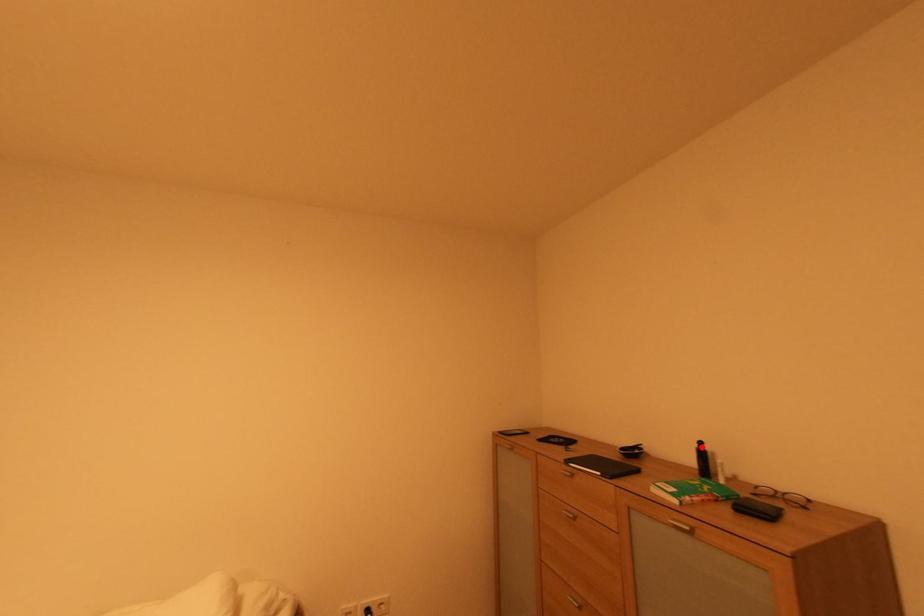
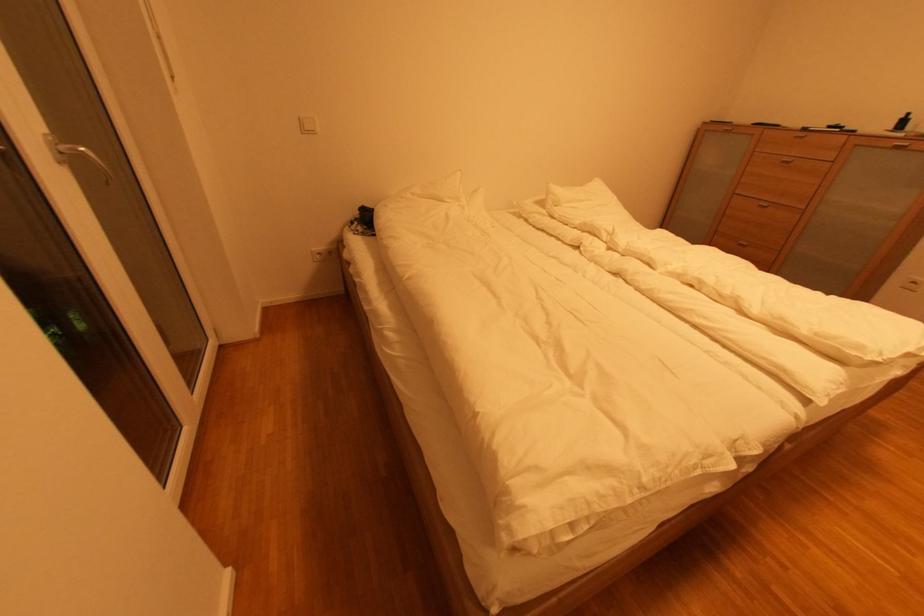
Where in the second image is the point corresponding to the highlighted location from the first image?

(908, 118)